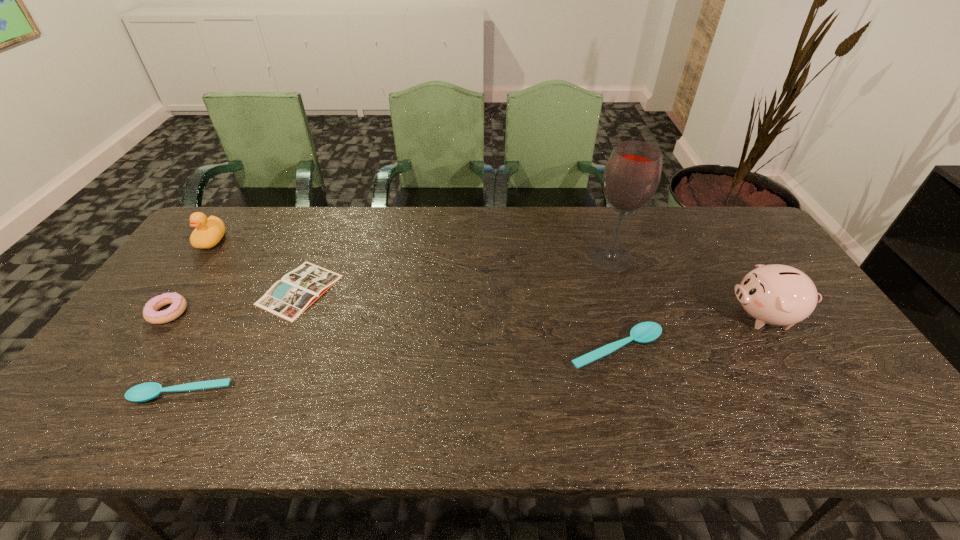
Identify the location of the left spoon. (143, 392).

You are a GUI agent. You are given a task and a screenshot of the screen. Output one action in this format:
    pyautogui.click(x=<x>, y=<y>)
    Task: Click on the nearer spoon
    
    Given the screenshot: What is the action you would take?
    pyautogui.click(x=143, y=392)

Locate an element on the screen. The height and width of the screenshot is (540, 960). the farther spoon is located at coordinates (644, 332).

The height and width of the screenshot is (540, 960). Identify the location of the right spoon. (644, 332).

Where is `duck`? duck is located at coordinates (209, 231).

Image resolution: width=960 pixels, height=540 pixels. I want to click on the rightmost object, so click(x=775, y=294).

Where is `the second tallest object`? This screenshot has height=540, width=960. the second tallest object is located at coordinates (775, 294).

At what (x,y) coordinates should I click in order to perform the action: click on alcohol. Please return your answer as a coordinate pair (x, y). The image size is (960, 540). Looking at the image, I should click on (632, 174).

Find the location of a particular element. the shortest object is located at coordinates (288, 298).

At what (x,y) coordinates should I click in order to perform the action: click on doughnut. Please return your answer as a coordinate pair (x, y). The width and height of the screenshot is (960, 540). Looking at the image, I should click on (150, 314).